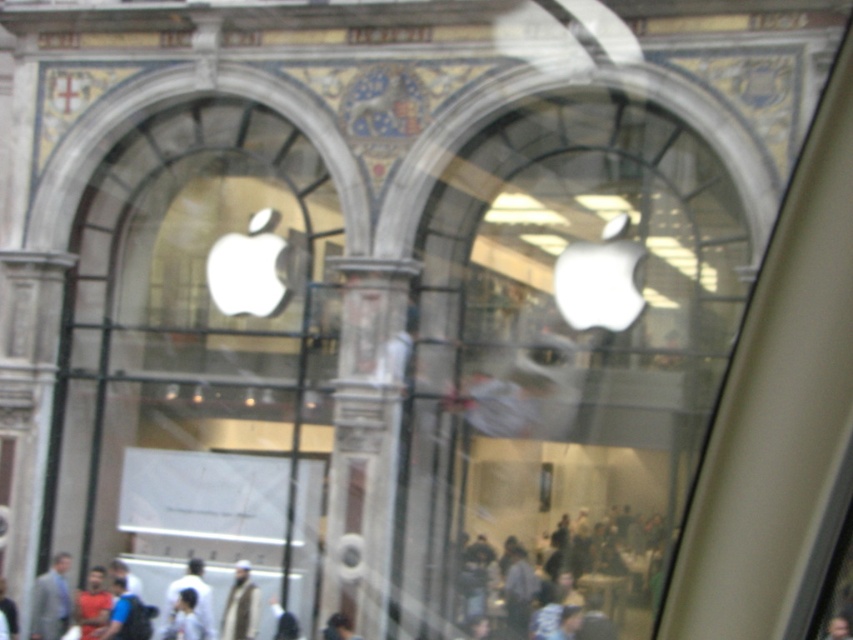
Question: In this image, where is transparent glass apple logo at center located relative to light blue shirt at lower left?

Choices:
 (A) above
 (B) below

Answer: (A)

Question: Can you confirm if transparent glass apple logo at center is wider than white glass apple logo at center?

Choices:
 (A) no
 (B) yes

Answer: (B)

Question: Does transparent glass apple logo at center have a lesser width compared to gray suit at lower left?

Choices:
 (A) no
 (B) yes

Answer: (A)

Question: Which of the following is the closest to the observer?

Choices:
 (A) white glass apple logo at center
 (B) light blue shirt at lower left
 (C) transparent glass apple logo at center

Answer: (C)

Question: Which object appears closest to the camera in this image?

Choices:
 (A) gray suit at lower left
 (B) white glass apple logo at center
 (C) transparent glass apple logo at center

Answer: (C)

Question: Which point is farther to the camera?

Choices:
 (A) (71, 442)
 (B) (241, 580)
 (C) (583, 371)
 (D) (38, 582)

Answer: (A)